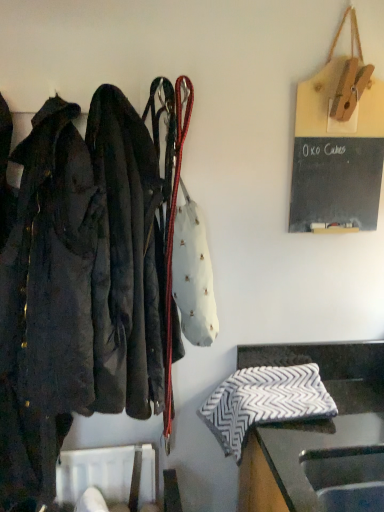
Question: Can you confirm if white leather handbag at center is wider than black and white zigzag-patterned cloth at lower right?

Choices:
 (A) yes
 (B) no

Answer: (B)

Question: Does white leather handbag at center have a smaller size compared to black and white zigzag-patterned cloth at lower right?

Choices:
 (A) no
 (B) yes

Answer: (B)

Question: Can we say white leather handbag at center lies outside black and white zigzag-patterned cloth at lower right?

Choices:
 (A) no
 (B) yes

Answer: (B)

Question: Does white leather handbag at center come behind black and white zigzag-patterned cloth at lower right?

Choices:
 (A) no
 (B) yes

Answer: (B)

Question: Is white leather handbag at center thinner than black and white zigzag-patterned cloth at lower right?

Choices:
 (A) no
 (B) yes

Answer: (B)

Question: From a real-world perspective, is black and white zigzag-patterned cloth at lower right above or below white leather handbag at center?

Choices:
 (A) above
 (B) below

Answer: (B)

Question: Visually, is black and white zigzag-patterned cloth at lower right positioned to the left or to the right of white leather handbag at center?

Choices:
 (A) right
 (B) left

Answer: (A)

Question: Do you think black and white zigzag-patterned cloth at lower right is within white leather handbag at center, or outside of it?

Choices:
 (A) outside
 (B) inside

Answer: (A)

Question: Relative to white leather handbag at center, is black and white zigzag-patterned cloth at lower right in front or behind?

Choices:
 (A) behind
 (B) front

Answer: (B)

Question: Relative to gray and white zigzag-patterned cloth at lower right, is black and white zigzag-patterned cloth at lower right in front or behind?

Choices:
 (A) front
 (B) behind

Answer: (A)

Question: In terms of height, does black and white zigzag-patterned cloth at lower right look taller or shorter compared to gray and white zigzag-patterned cloth at lower right?

Choices:
 (A) short
 (B) tall

Answer: (B)

Question: From the image's perspective, is black and white zigzag-patterned cloth at lower right located above or below gray and white zigzag-patterned cloth at lower right?

Choices:
 (A) above
 (B) below

Answer: (B)

Question: Considering the positions of point (261, 458) and point (249, 388), is point (261, 458) closer or farther from the camera than point (249, 388)?

Choices:
 (A) closer
 (B) farther

Answer: (A)

Question: From their relative heights in the image, would you say black and white zigzag-patterned cloth at lower right is taller or shorter than black plastic sink at lower right?

Choices:
 (A) tall
 (B) short

Answer: (A)

Question: Choose the correct answer: Is black and white zigzag-patterned cloth at lower right inside black plastic sink at lower right or outside it?

Choices:
 (A) outside
 (B) inside

Answer: (A)